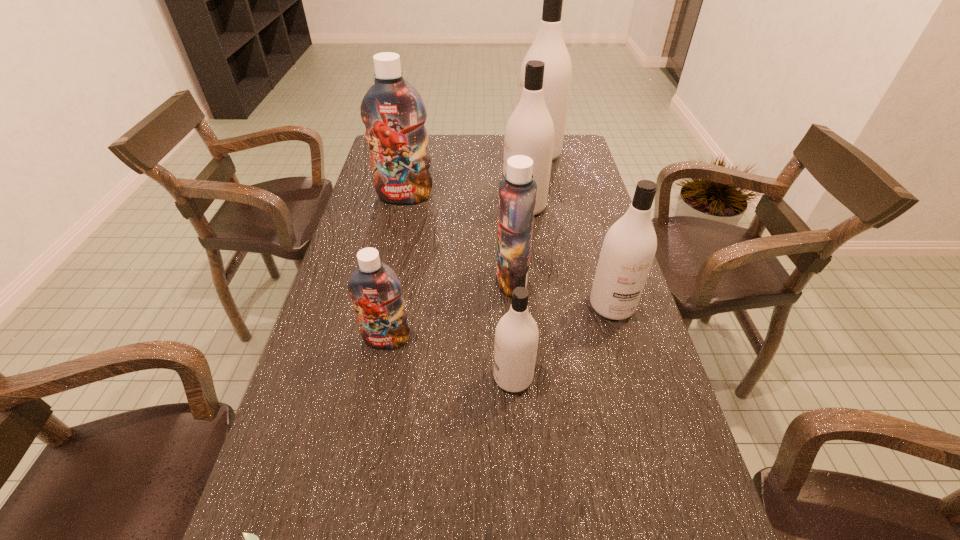
Locate an element on the screen. The image size is (960, 540). vacant space located on the front label of the second biggest blue shampoo is located at coordinates [422, 279].

This screenshot has width=960, height=540. What are the coordinates of `vacant space situated on the front-facing side of the third farthest white shampoo` in the screenshot? It's located at (626, 353).

Identify the location of free space located 0.280m on the front-facing side of the nearest shampoo. tap(367, 377).

Identify the location of vacant space located 0.380m on the front-facing side of the nearest shampoo. This screenshot has height=540, width=960. (323, 377).

I want to click on vacant space located 0.240m on the front-facing side of the nearest shampoo, so pos(385,377).

Image resolution: width=960 pixels, height=540 pixels. Find the location of `vacant space situated 0.100m on the front label of the smallest blue shampoo`. vacant space situated 0.100m on the front label of the smallest blue shampoo is located at coordinates (377, 388).

Where is `object located at the far edge`? This screenshot has height=540, width=960. object located at the far edge is located at coordinates (549, 47).

Where is `object present at the far right corner`? The width and height of the screenshot is (960, 540). object present at the far right corner is located at coordinates (549, 47).

In the image, there is a desktop. Where is `vacant space at the left edge`? vacant space at the left edge is located at coordinates (398, 238).

At what (x,y) coordinates should I click in order to perform the action: click on vacant space at the right edge of the desktop. Please return your answer as a coordinate pair (x, y). Looking at the image, I should click on (553, 185).